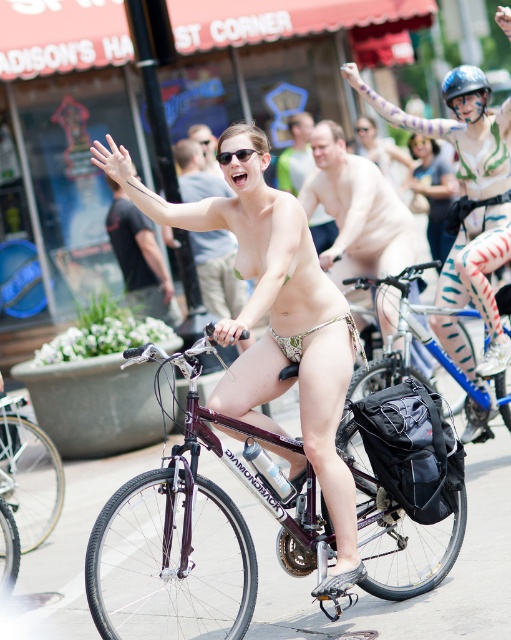
What is the 2D coordinate of the matte gold bicycle at center?

The matte gold bicycle at center is located at the 2D coordinate point of (218, 272).

You are a photographer capturing the central cyclist in the scene. You notice the smooth beige shorts at center and the matte gold bikini at center. Which item of clothing is positioned lower on the cyclist?

The smooth beige shorts at center is positioned lower than the matte gold bikini at center since it is not as tall as the bikini.